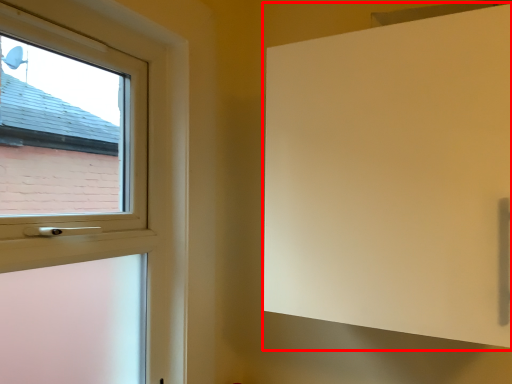
Question: From the image's perspective, what is the correct spatial positioning of screen door (annotated by the red box) in reference to window?

Choices:
 (A) above
 (B) below

Answer: (A)